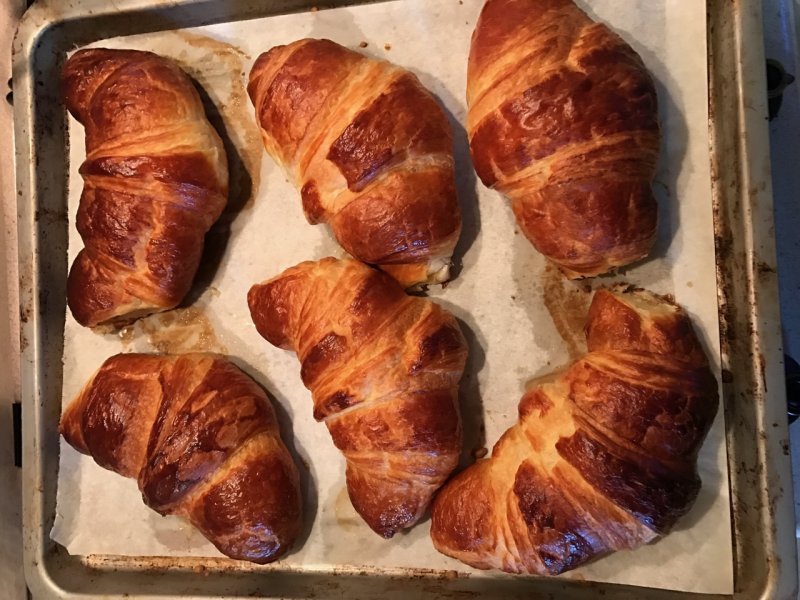
Where is `stains on baking tray`? stains on baking tray is located at coordinates (724, 247), (730, 329).